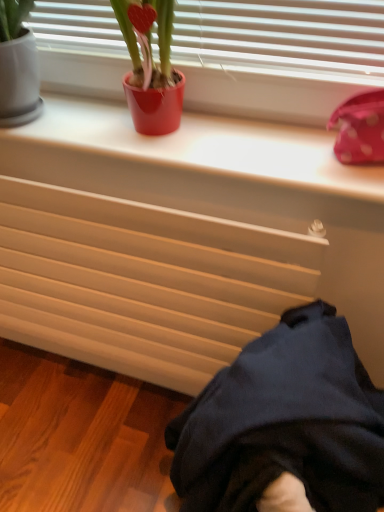
Question: Is white smooth window sill at upper center looking in the opposite direction of dark blue fabric at lower right?

Choices:
 (A) no
 (B) yes

Answer: (A)

Question: Can you confirm if white smooth window sill at upper center is shorter than dark blue fabric at lower right?

Choices:
 (A) yes
 (B) no

Answer: (A)

Question: Is white smooth window sill at upper center to the right of dark blue fabric at lower right from the viewer's perspective?

Choices:
 (A) yes
 (B) no

Answer: (B)

Question: Can you confirm if white smooth window sill at upper center is bigger than dark blue fabric at lower right?

Choices:
 (A) no
 (B) yes

Answer: (A)

Question: Is white smooth window sill at upper center not close to dark blue fabric at lower right?

Choices:
 (A) yes
 (B) no

Answer: (B)

Question: Is point (185, 366) positioned closer to the camera than point (147, 112)?

Choices:
 (A) closer
 (B) farther

Answer: (B)

Question: From their relative heights in the image, would you say matte beige radiator at lower center is taller or shorter than shiny red pot at upper center?

Choices:
 (A) short
 (B) tall

Answer: (B)

Question: In terms of size, does matte beige radiator at lower center appear bigger or smaller than shiny red pot at upper center?

Choices:
 (A) big
 (B) small

Answer: (A)

Question: Considering their positions, is matte beige radiator at lower center located in front of or behind shiny red pot at upper center?

Choices:
 (A) front
 (B) behind

Answer: (B)

Question: Is matte beige radiator at lower center bigger or smaller than dark blue fabric at lower right?

Choices:
 (A) big
 (B) small

Answer: (B)

Question: Is point (188, 392) positioned closer to the camera than point (322, 305)?

Choices:
 (A) farther
 (B) closer

Answer: (A)

Question: In terms of height, does matte beige radiator at lower center look taller or shorter compared to dark blue fabric at lower right?

Choices:
 (A) tall
 (B) short

Answer: (B)

Question: Considering the positions of matte beige radiator at lower center and dark blue fabric at lower right in the image, is matte beige radiator at lower center wider or thinner than dark blue fabric at lower right?

Choices:
 (A) thin
 (B) wide

Answer: (A)

Question: Is dark blue fabric at lower right taller or shorter than matte beige radiator at lower center?

Choices:
 (A) tall
 (B) short

Answer: (A)

Question: Would you say dark blue fabric at lower right is to the left or to the right of matte beige radiator at lower center in the picture?

Choices:
 (A) right
 (B) left

Answer: (A)